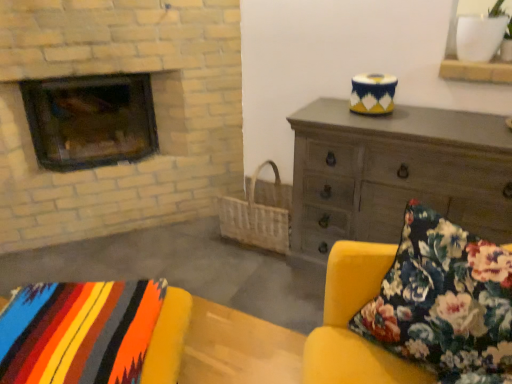
The width and height of the screenshot is (512, 384). What do you see at coordinates (90, 336) in the screenshot? I see `multicolored woven blanket at lower left` at bounding box center [90, 336].

Describe the element at coordinates (396, 173) in the screenshot. Image resolution: width=512 pixels, height=384 pixels. I see `dark gray wooden chest of drawers at upper right` at that location.

Describe the element at coordinates (415, 308) in the screenshot. Image resolution: width=512 pixels, height=384 pixels. I see `floral fabric cushion at lower right` at that location.

Locate an element on the screen. The height and width of the screenshot is (384, 512). dark brown wood burning stove at left is located at coordinates (x=90, y=120).

Is floral fabric cushion at lower right a part of multicolored woven blanket at lower left?

No, floral fabric cushion at lower right is not a part of multicolored woven blanket at lower left.

Can you confirm if multicolored woven blanket at lower left is thinner than floral fabric cushion at lower right?

Incorrect, the width of multicolored woven blanket at lower left is not less than that of floral fabric cushion at lower right.

Considering the sizes of objects multicolored woven blanket at lower left and floral fabric cushion at lower right in the image provided, who is taller, multicolored woven blanket at lower left or floral fabric cushion at lower right?

floral fabric cushion at lower right.

From the image's perspective, which one is positioned higher, floral fabric cushion at lower right or dark brown wood burning stove at left?

dark brown wood burning stove at left appears higher in the image.

Choose the correct answer: Is floral fabric cushion at lower right inside dark brown wood burning stove at left or outside it?

The correct answer is: outside.

I want to click on studio couch in front of the dark brown wood burning stove at left, so click(415, 308).

Is dark brown wood burning stove at left completely or partially outside of floral fabric cushion at lower right?

Yes.

From the image's perspective, is dark brown wood burning stove at left located above or below floral fabric cushion at lower right?

Clearly, from the image's perspective, dark brown wood burning stove at left is above floral fabric cushion at lower right.

Is dark brown wood burning stove at left oriented away from floral fabric cushion at lower right?

dark brown wood burning stove at left does not have its back to floral fabric cushion at lower right.

Which of these two, dark brown wood burning stove at left or floral fabric cushion at lower right, stands shorter?

With less height is floral fabric cushion at lower right.

Looking at this image, considering the relative positions of dark brown wood burning stove at left and dark gray wooden chest of drawers at upper right in the image provided, is dark brown wood burning stove at left in front of dark gray wooden chest of drawers at upper right?

No.

Is dark brown wood burning stove at left positioned far away from dark gray wooden chest of drawers at upper right?

dark brown wood burning stove at left is positioned a significant distance from dark gray wooden chest of drawers at upper right.

Locate an element on the screen. This screenshot has width=512, height=384. the chest of drawers that appears below the dark brown wood burning stove at left (from a real-world perspective) is located at coordinates (396, 173).

Is dark brown wood burning stove at left completely or partially outside of dark gray wooden chest of drawers at upper right?

Yes, dark brown wood burning stove at left is not within dark gray wooden chest of drawers at upper right.

What's the angular difference between multicolored woven blanket at lower left and dark brown wood burning stove at left's facing directions?

The angle between the facing direction of multicolored woven blanket at lower left and the facing direction of dark brown wood burning stove at left is 20.3 degrees.

Does multicolored woven blanket at lower left turn towards dark brown wood burning stove at left?

No, multicolored woven blanket at lower left is not facing towards dark brown wood burning stove at left.

From the picture: Between multicolored woven blanket at lower left and dark brown wood burning stove at left, which one is positioned in front?

multicolored woven blanket at lower left is closer to the camera.

Where is `blanket that is under the dark brown wood burning stove at left (from a real-world perspective)`? blanket that is under the dark brown wood burning stove at left (from a real-world perspective) is located at coordinates (x=90, y=336).

Is dark gray wooden chest of drawers at upper right aimed at multicolored woven blanket at lower left?

Yes, dark gray wooden chest of drawers at upper right is aimed at multicolored woven blanket at lower left.

Is dark gray wooden chest of drawers at upper right next to multicolored woven blanket at lower left and touching it?

They are not placed beside each other.

Based on the photo, is dark gray wooden chest of drawers at upper right to the right of multicolored woven blanket at lower left from the viewer's perspective?

Yes.

Who is smaller, dark gray wooden chest of drawers at upper right or multicolored woven blanket at lower left?

multicolored woven blanket at lower left.

Is multicolored woven blanket at lower left situated inside dark gray wooden chest of drawers at upper right or outside?

The correct answer is: outside.

Considering the relative sizes of multicolored woven blanket at lower left and dark gray wooden chest of drawers at upper right in the image provided, is multicolored woven blanket at lower left thinner than dark gray wooden chest of drawers at upper right?

Indeed, multicolored woven blanket at lower left has a lesser width compared to dark gray wooden chest of drawers at upper right.

Is multicolored woven blanket at lower left far from dark gray wooden chest of drawers at upper right?

Yes, multicolored woven blanket at lower left and dark gray wooden chest of drawers at upper right are quite far apart.

From a real-world perspective, is multicolored woven blanket at lower left positioned above or below dark gray wooden chest of drawers at upper right?

multicolored woven blanket at lower left is situated higher than dark gray wooden chest of drawers at upper right in the real world.

At what (x,y) coordinates should I click in order to perform the action: click on studio couch above the multicolored woven blanket at lower left (from a real-world perspective). Please return your answer as a coordinate pair (x, y). Looking at the image, I should click on (415, 308).

Find the location of a particular element. wood burning stove on the left side of floral fabric cushion at lower right is located at coordinates (90, 120).

When comparing their distances from multicolored woven blanket at lower left, does floral fabric cushion at lower right or dark brown wood burning stove at left seem closer?

The object closer to multicolored woven blanket at lower left is floral fabric cushion at lower right.

Looking at the image, which one is located closer to multicolored woven blanket at lower left, dark brown wood burning stove at left or dark gray wooden chest of drawers at upper right?

dark gray wooden chest of drawers at upper right.

Estimate the real-world distances between objects in this image. Which object is further from multicolored woven blanket at lower left, dark gray wooden chest of drawers at upper right or floral fabric cushion at lower right?

Among the two, dark gray wooden chest of drawers at upper right is located further to multicolored woven blanket at lower left.

When comparing their distances from multicolored woven blanket at lower left, does dark gray wooden chest of drawers at upper right or dark brown wood burning stove at left seem closer?

dark gray wooden chest of drawers at upper right is positioned closer to the anchor multicolored woven blanket at lower left.

Based on their spatial positions, is floral fabric cushion at lower right or dark brown wood burning stove at left further from dark gray wooden chest of drawers at upper right?

The object further to dark gray wooden chest of drawers at upper right is dark brown wood burning stove at left.

Estimate the real-world distances between objects in this image. Which object is further from dark gray wooden chest of drawers at upper right, floral fabric cushion at lower right or multicolored woven blanket at lower left?

multicolored woven blanket at lower left is further to dark gray wooden chest of drawers at upper right.

Looking at the image, which one is located further to dark brown wood burning stove at left, multicolored woven blanket at lower left or dark gray wooden chest of drawers at upper right?

The object further to dark brown wood burning stove at left is multicolored woven blanket at lower left.

Looking at the image, which one is located further to dark gray wooden chest of drawers at upper right, dark brown wood burning stove at left or floral fabric cushion at lower right?

Among the two, dark brown wood burning stove at left is located further to dark gray wooden chest of drawers at upper right.

The image size is (512, 384). What are the coordinates of `blanket between dark brown wood burning stove at left and dark gray wooden chest of drawers at upper right` in the screenshot? It's located at (90, 336).

Find the location of `studio couch between dark brown wood burning stove at left and dark gray wooden chest of drawers at upper right in the horizontal direction`. studio couch between dark brown wood burning stove at left and dark gray wooden chest of drawers at upper right in the horizontal direction is located at coordinates (415, 308).

Find the location of a particular element. blanket between dark brown wood burning stove at left and floral fabric cushion at lower right is located at coordinates (90, 336).

You are a GUI agent. You are given a task and a screenshot of the screen. Output one action in this format:
    pyautogui.click(x=<x>, y=<y>)
    Task: Click on the studio couch located between multicolored woven blanket at lower left and dark gray wooden chest of drawers at upper right in the left-right direction
    The height and width of the screenshot is (384, 512).
    Given the screenshot: What is the action you would take?
    point(415,308)